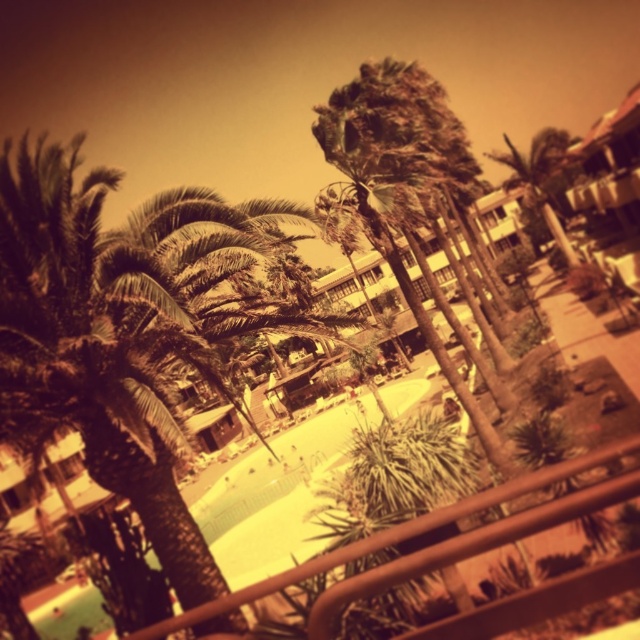
Does brown metal railing at center have a lesser height compared to green leafy palm tree at center?

Yes.

Is brown metal railing at center wider than green leafy palm tree at center?

No, brown metal railing at center is not wider than green leafy palm tree at center.

Which is in front, point (353, 545) or point (532, 161)?

Point (353, 545)

Identify the location of brown metal railing at center. The width and height of the screenshot is (640, 640). (388, 538).